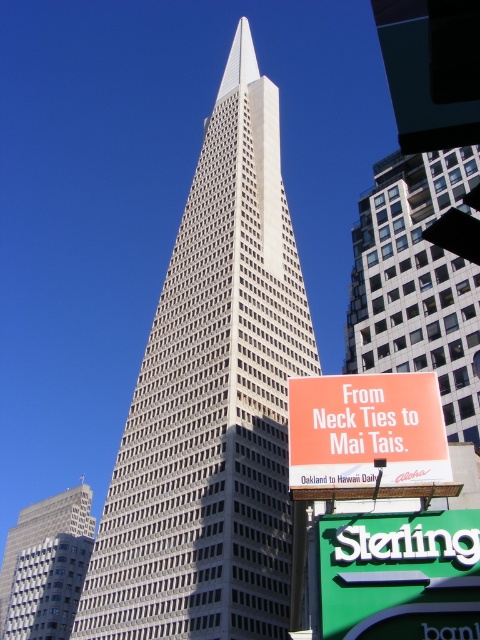
Question: Does white concrete tower at center appear on the right side of gray concrete skyscraper at center?

Choices:
 (A) yes
 (B) no

Answer: (A)

Question: Which of the following is the closest to the observer?

Choices:
 (A) (456, 512)
 (B) (433, 278)
 (C) (382, 483)
 (D) (69, 579)

Answer: (A)

Question: Which point is farther to the camera?

Choices:
 (A) (24, 579)
 (B) (367, 202)
 (C) (443, 420)
 (D) (437, 524)

Answer: (A)

Question: Which is nearer to the orange matte sign at center?

Choices:
 (A) white concrete tower at center
 (B) green plastic sign at lower right
 (C) white concrete skyscraper at upper center
 (D) gray concrete skyscraper at center

Answer: (B)

Question: Does white concrete tower at center come behind white concrete skyscraper at upper center?

Choices:
 (A) no
 (B) yes

Answer: (B)

Question: Does orange matte sign at center appear over gray concrete skyscraper at center?

Choices:
 (A) yes
 (B) no

Answer: (A)